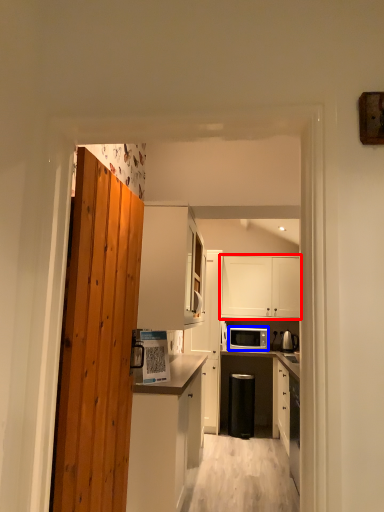
Question: Among these objects, which one is farthest to the camera, cabinetry (highlighted by a red box) or microwave oven (highlighted by a blue box)?

Choices:
 (A) cabinetry
 (B) microwave oven

Answer: (A)